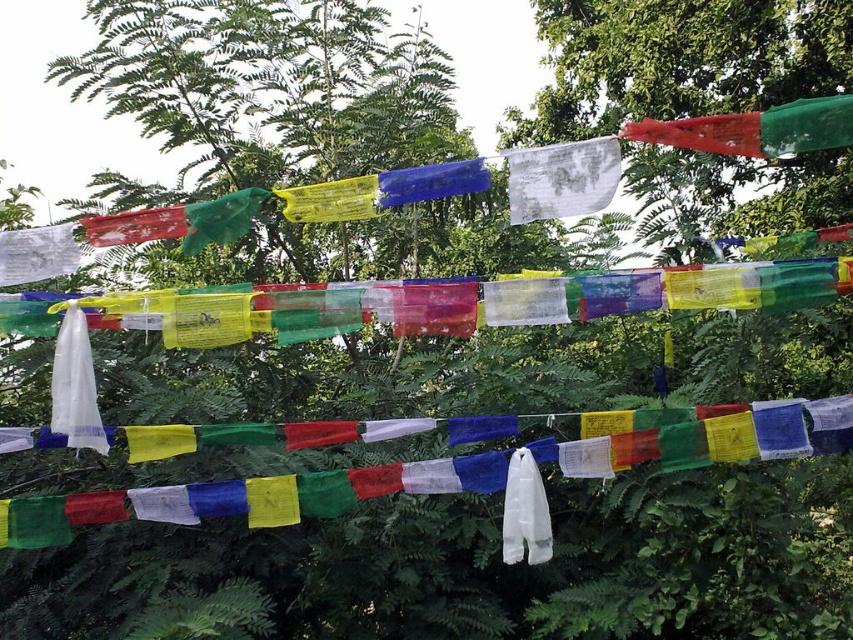
Between transparent plastic bag at lower left and white sheer fabric at center, which one is positioned lower?

white sheer fabric at center is below.

Between transparent plastic bag at lower left and white sheer fabric at center, which one appears on the left side from the viewer's perspective?

Positioned to the left is white sheer fabric at center.

Identify the location of transparent plastic bag at lower left. (718, 560).

At what (x,y) coordinates should I click in order to perform the action: click on transparent plastic bag at lower left. Please return your answer as a coordinate pair (x, y). Looking at the image, I should click on (718, 560).

Can you confirm if white sheer fabric at center is positioned below yellow translucent flag at center?

No, white sheer fabric at center is not below yellow translucent flag at center.

In the scene shown: Measure the distance between point (535, 163) and camera.

They are 2.53 meters apart.

Which is behind, point (584, 154) or point (480, 172)?

The point (480, 172) is behind.

At what (x,y) coordinates should I click in order to perform the action: click on white sheer fabric at center. Please return your answer as a coordinate pair (x, y). The image size is (853, 640). Looking at the image, I should click on (561, 179).

Which is behind, point (743, 124) or point (312, 211)?

The point (312, 211) is behind.

I want to click on red translucent flag at upper right, so pos(756,129).